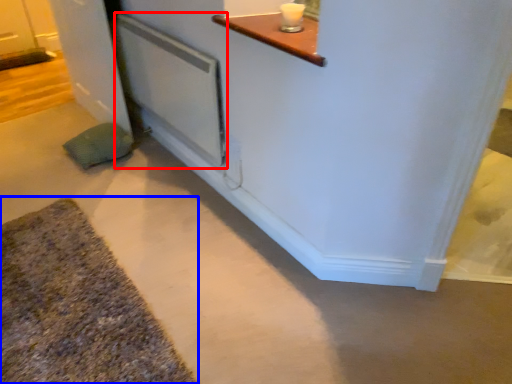
Question: Which point is closer to the camera, screen door (highlighted by a red box) or bath mat (highlighted by a blue box)?

Choices:
 (A) screen door
 (B) bath mat

Answer: (B)